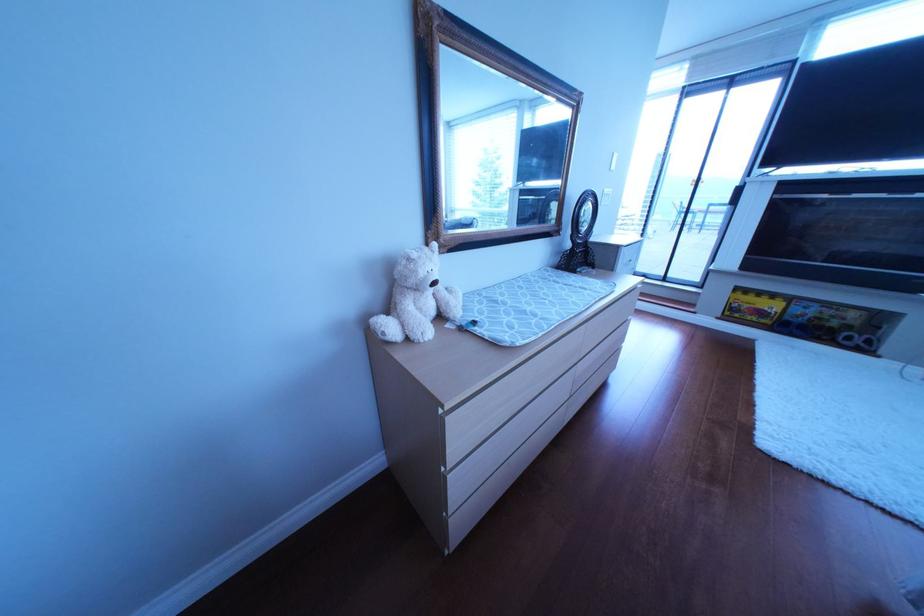
Find where to fold the patterned changing pad. Please return your answer as a coordinate pair (x, y).

(529, 304)